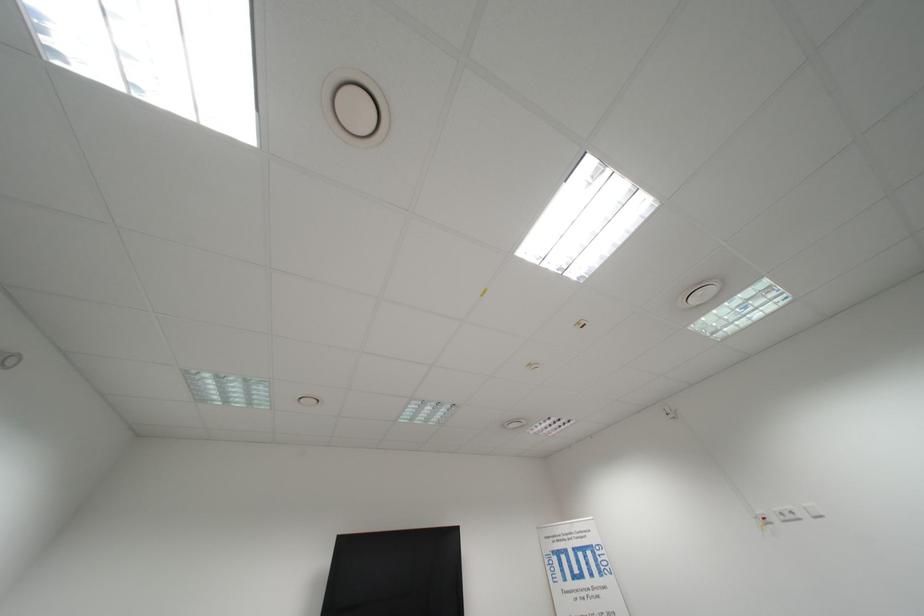
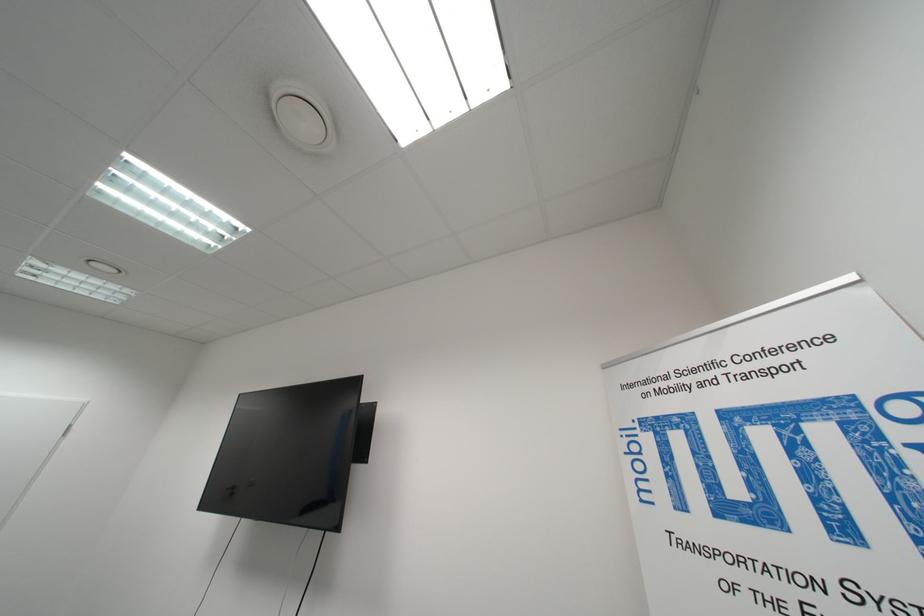
The point at [603,519] is marked in the first image. Where is the corresponding point in the second image?

(861, 278)